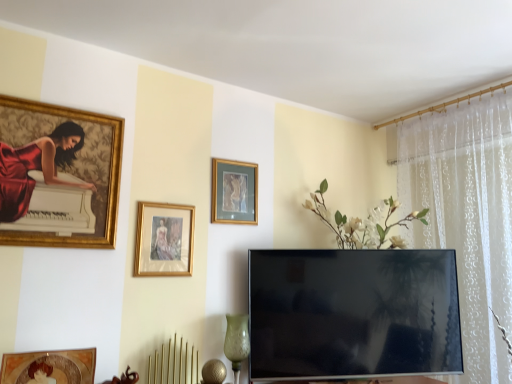
Question: Is gold-framed picture at center, positioned as the second picture frame in left-to-right order, outside gold-framed painting at upper left, the 1th picture frame in the left-to-right sequence?

Choices:
 (A) yes
 (B) no

Answer: (A)

Question: Is gold-framed picture at center, positioned as the second picture frame in left-to-right order, closer to camera compared to gold-framed painting at upper left, which ranks as the first picture frame in front-to-back order?

Choices:
 (A) no
 (B) yes

Answer: (A)

Question: Is gold-framed picture at center, positioned as the second picture frame in left-to-right order, far from gold-framed painting at upper left, which ranks as the first picture frame in front-to-back order?

Choices:
 (A) yes
 (B) no

Answer: (B)

Question: From a real-world perspective, does gold-framed picture at center, positioned as the 2th picture frame in back-to-front order, stand above gold-framed painting at upper left, the third picture frame positioned from the back?

Choices:
 (A) yes
 (B) no

Answer: (B)

Question: From a real-world perspective, is gold-framed picture at center, the 2th picture frame viewed from the front, under gold-framed painting at upper left, the 1th picture frame in the left-to-right sequence?

Choices:
 (A) yes
 (B) no

Answer: (A)

Question: From the image's perspective, is flat screen tv at center positioned above or below gold-framed painting at upper left, arranged as the third picture frame when viewed from the right?

Choices:
 (A) above
 (B) below

Answer: (B)

Question: Considering their positions, is flat screen tv at center located in front of or behind gold-framed painting at upper left, the 1th picture frame in the left-to-right sequence?

Choices:
 (A) behind
 (B) front

Answer: (A)

Question: Is flat screen tv at center inside or outside of gold-framed painting at upper left, which ranks as the first picture frame in front-to-back order?

Choices:
 (A) outside
 (B) inside

Answer: (A)

Question: Is flat screen tv at center taller or shorter than gold-framed painting at upper left, which ranks as the first picture frame in front-to-back order?

Choices:
 (A) short
 (B) tall

Answer: (B)

Question: From a real-world perspective, relative to flat screen tv at center, is gold-framed painting at upper left, which ranks as the first picture frame in front-to-back order, vertically above or below?

Choices:
 (A) above
 (B) below

Answer: (A)

Question: Relative to flat screen tv at center, is gold-framed painting at upper left, the 1th picture frame in the left-to-right sequence, in front or behind?

Choices:
 (A) front
 (B) behind

Answer: (A)

Question: Is gold-framed painting at upper left, the third picture frame positioned from the back, bigger or smaller than flat screen tv at center?

Choices:
 (A) small
 (B) big

Answer: (A)

Question: Do you think gold-framed painting at upper left, the third picture frame positioned from the back, is within flat screen tv at center, or outside of it?

Choices:
 (A) inside
 (B) outside

Answer: (B)

Question: In the image, is gold-framed picture at center, acting as the 3th picture frame starting from the front, on the left side or the right side of gold-framed painting at upper left, the third picture frame positioned from the back?

Choices:
 (A) right
 (B) left

Answer: (A)

Question: Considering the positions of point (231, 167) and point (81, 160), is point (231, 167) closer or farther from the camera than point (81, 160)?

Choices:
 (A) farther
 (B) closer

Answer: (A)